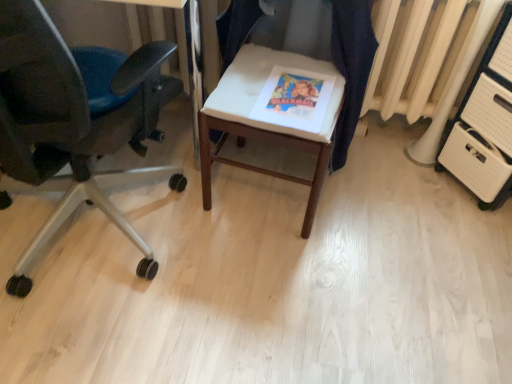
This screenshot has height=384, width=512. In order to click on free space that is to the left of white plastic file cabinet at right in this screenshot , I will do `click(408, 188)`.